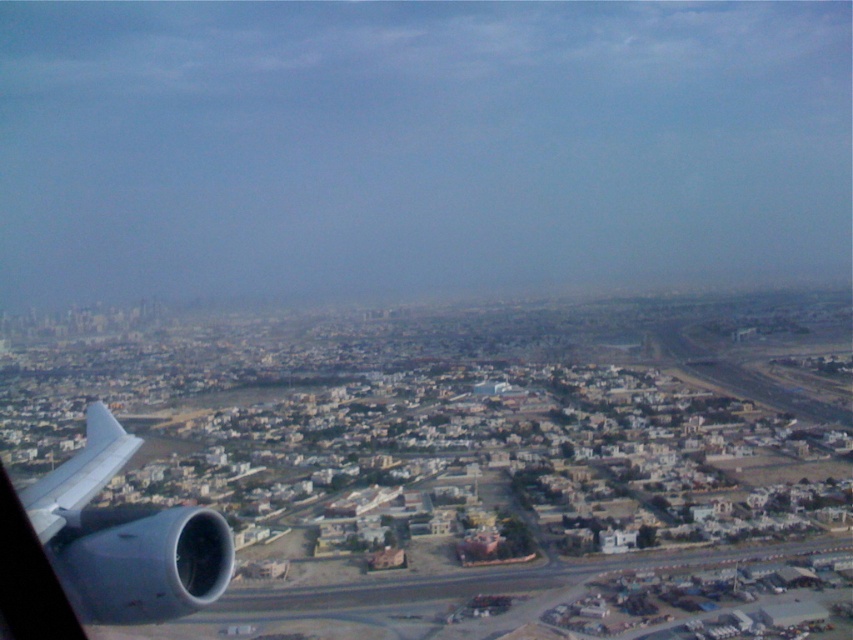
From the picture: You are a pilot flying at an altitude of 2100 feet. You notice a metallic gray engine at bottom left in your view. Is the engine part of your aircraft or a separate object on the ground?

The metallic gray engine at bottom left is 2103.77 feet from the viewer, which is slightly higher than the aircraft altitude of 2100 feet. This suggests the engine is part of the aircraft since it would be positioned near the wing and engine, not on the ground below.

You are a pilot reviewing a photo of an urban landscape taken from an airplane. In the image, you see the metallic gray engine at bottom left and the white matte wing at lower left. Which object is positioned lower in the photo?

The metallic gray engine at bottom left is located below the white matte wing at lower left, so it is positioned lower in the photo.

You are a drone operator trying to deliver a package to a specific location marked by the point at coordinates (151, 520). Your drone has a maximum flight range of 650 meters. Based on the image, can your drone reach the destination without needing to recharge?

The point at coordinates (151, 520) is 653.70 meters away from the camera, which exceeds the drone operator drone maximum flight range of 650 meters. Therefore, the drone cannot reach the destination without recharging.